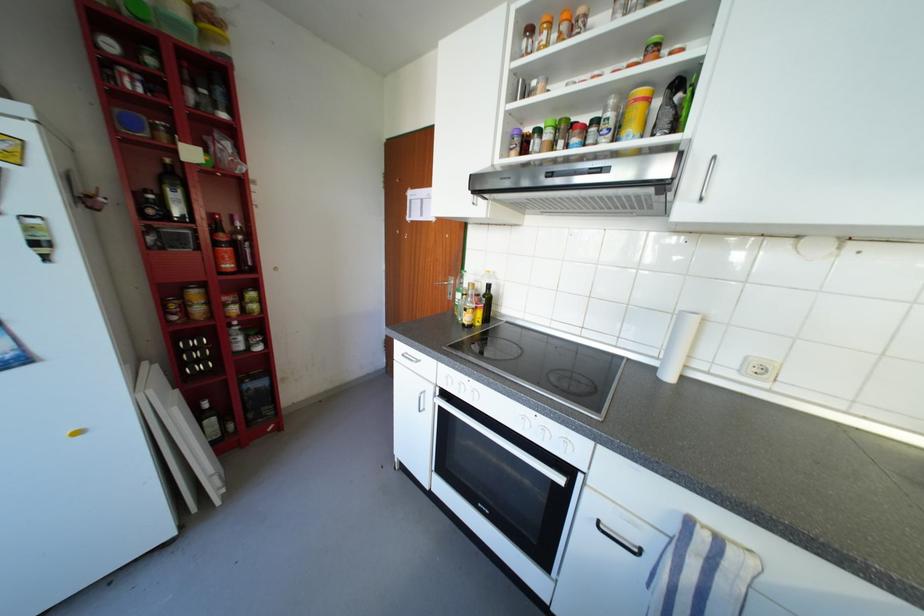
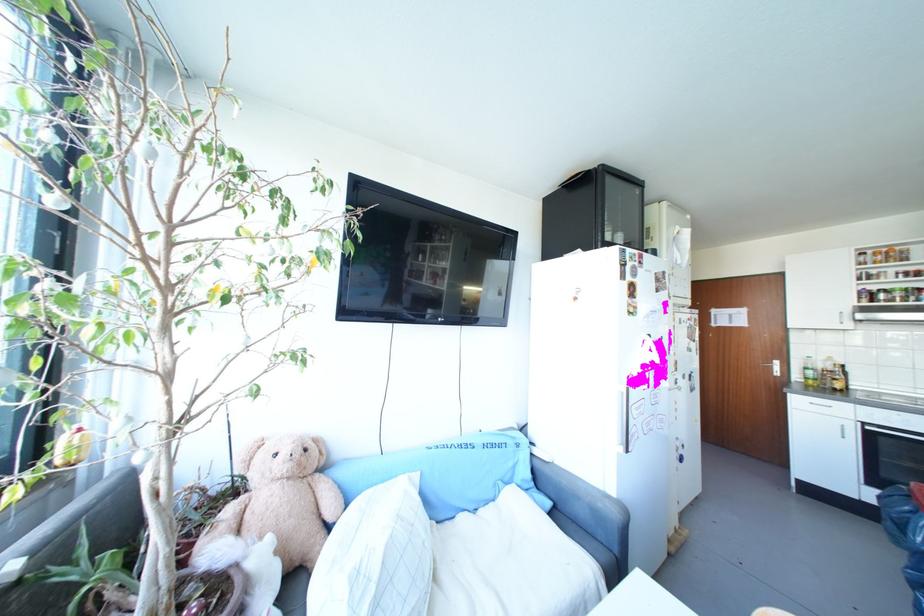
In a continuous first-person perspective shot, in which direction is the camera moving?

The cameraman moved toward left, backward.